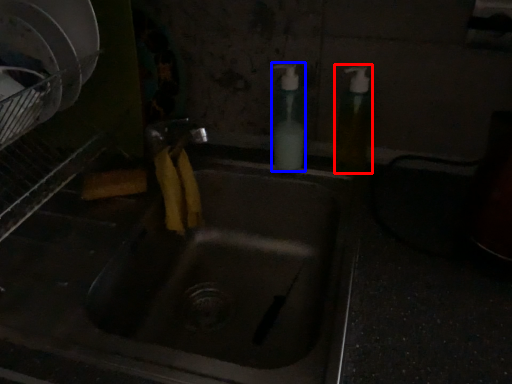
Question: Which point is further to the camera, soap dispenser (highlighted by a red box) or soap dispenser (highlighted by a blue box)?

Choices:
 (A) soap dispenser
 (B) soap dispenser

Answer: (B)